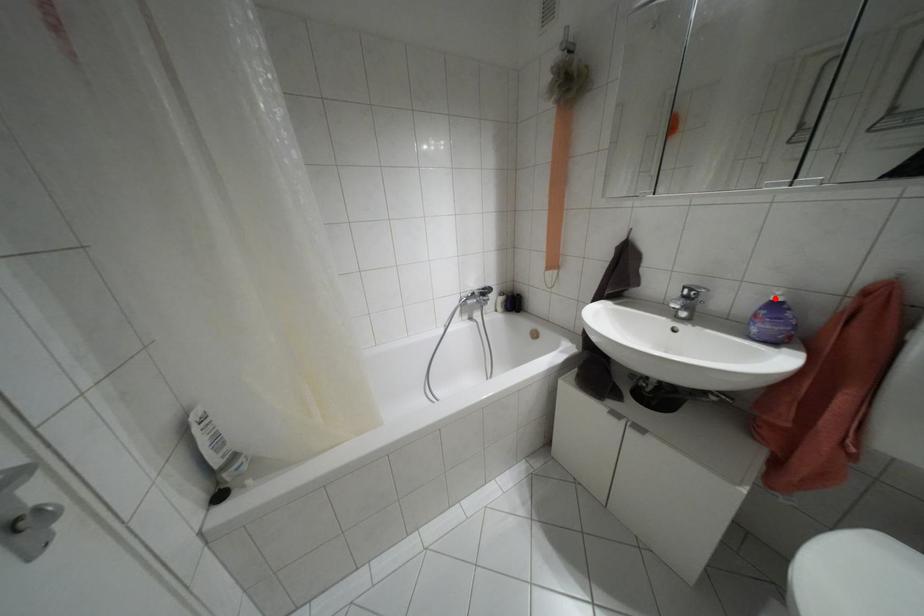
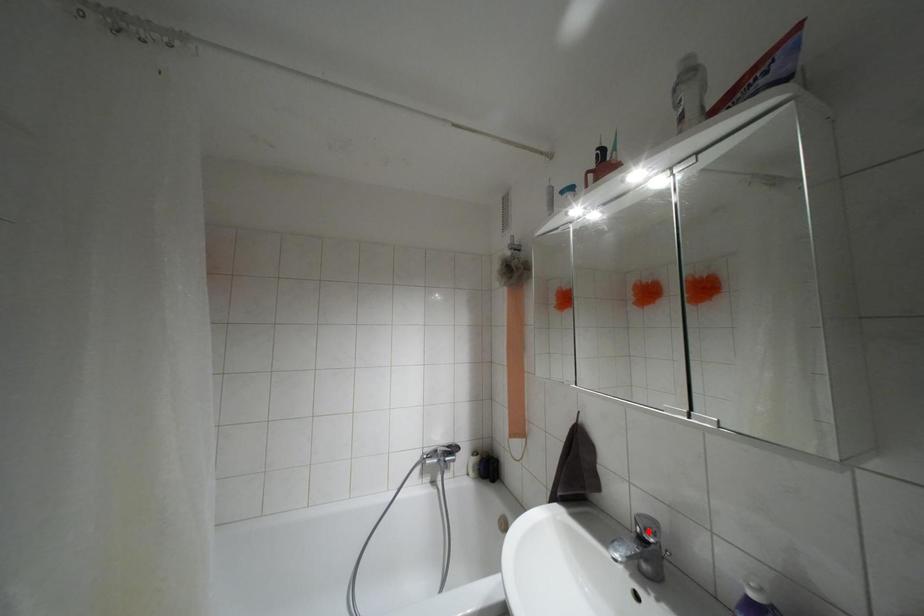
I am providing you with two images of the same scene from different viewpoints. A red point is marked on the first image and another point is marked on the second image. Does the point marked in image1 correspond to the same location as the one in image2?

No